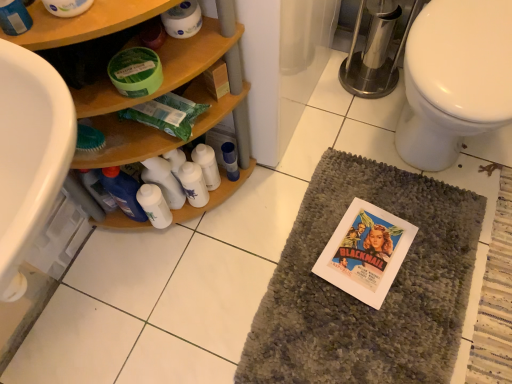
In order to click on vacant space in between white glossy toilet at right and blue glossy bottle at center, the first bottle positioned from the right in this screenshot , I will do `click(337, 164)`.